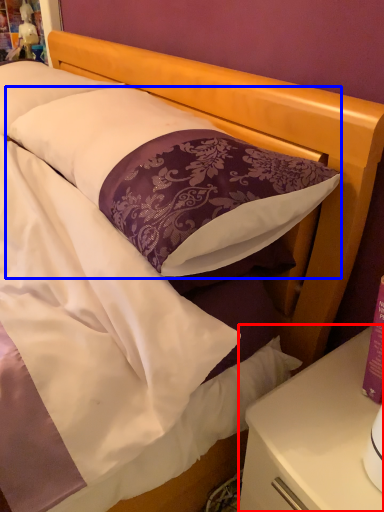
Question: Among these objects, which one is farthest to the camera, nightstand (highlighted by a red box) or pillow (highlighted by a blue box)?

Choices:
 (A) nightstand
 (B) pillow

Answer: (A)